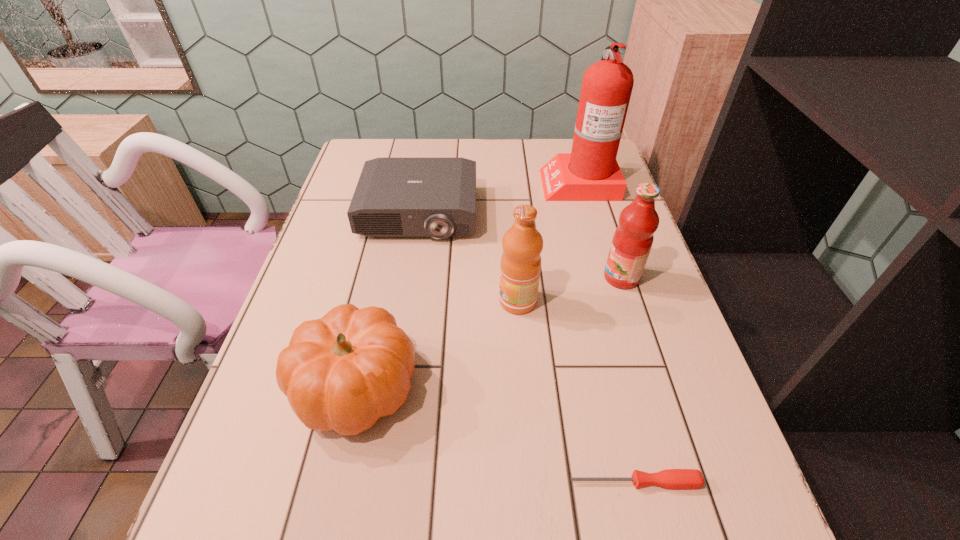
What are the coordinates of `vacant area at the left edge of the desktop` in the screenshot? It's located at (311, 314).

Find the location of a particular element. This screenshot has width=960, height=540. free space at the right edge is located at coordinates (656, 444).

Where is `blank space at the near left corner of the desktop`? blank space at the near left corner of the desktop is located at coordinates [x=239, y=526].

This screenshot has height=540, width=960. Identify the location of free space between the third object from left to right and the pumpkin. [437, 344].

Where is `vacant area that lies between the screwdriver and the tallest object`? This screenshot has height=540, width=960. vacant area that lies between the screwdriver and the tallest object is located at coordinates (607, 332).

You are a GUI agent. You are given a task and a screenshot of the screen. Output one action in this format:
    pyautogui.click(x=<x>, y=<y>)
    Task: Click on the free space between the fire extinguisher and the fifth tallest object
    The height and width of the screenshot is (540, 960).
    Given the screenshot: What is the action you would take?
    pyautogui.click(x=499, y=198)

In order to click on empty space between the projector and the third object from left to right in this screenshot , I will do `click(468, 258)`.

Locate an element on the screen. The image size is (960, 540). vacant point located between the fifth farthest object and the right fruit juice is located at coordinates (489, 332).

The width and height of the screenshot is (960, 540). I want to click on free space between the tallest object and the fifth tallest object, so click(499, 198).

You are a GUI agent. You are given a task and a screenshot of the screen. Output one action in this format:
    pyautogui.click(x=<x>, y=<y>)
    Task: Click on the free space between the pumpkin and the right fruit juice
    
    Given the screenshot: What is the action you would take?
    pyautogui.click(x=489, y=332)